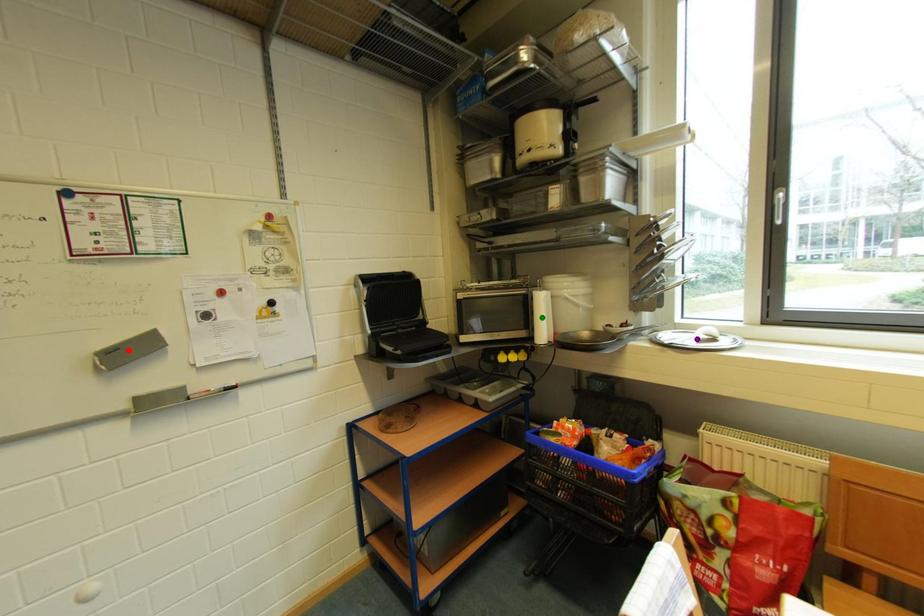
Order these from nearest to farthest:
- purple point
- red point
- green point

red point → purple point → green point